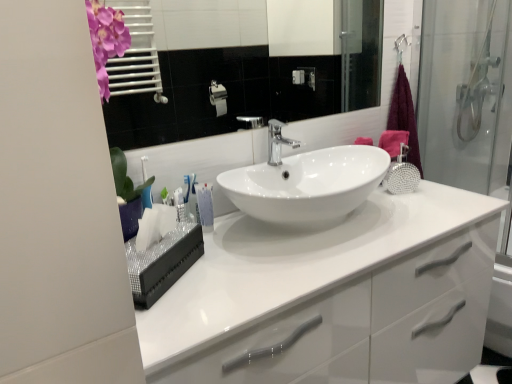
Question: From a real-world perspective, is purple fabric towel at right above or below white glossy cabinet at center?

Choices:
 (A) above
 (B) below

Answer: (A)

Question: Choose the correct answer: Is purple fabric towel at right inside white glossy cabinet at center or outside it?

Choices:
 (A) outside
 (B) inside

Answer: (A)

Question: Which of these objects is positioned closest to the white glossy mirror at upper center?

Choices:
 (A) polished chrome tap at center
 (B) white glossy tube at center
 (C) white glossy cabinet at center
 (D) pink fabric bath towel at upper right
 (E) purple fabric towel at right

Answer: (E)

Question: Estimate the real-world distances between objects in this image. Which object is farther from the polished chrome tap at center?

Choices:
 (A) white glossy mirror at upper center
 (B) white glossy cabinet at center
 (C) white glossy tube at center
 (D) purple fabric towel at right
 (E) pink fabric bath towel at upper right

Answer: (A)